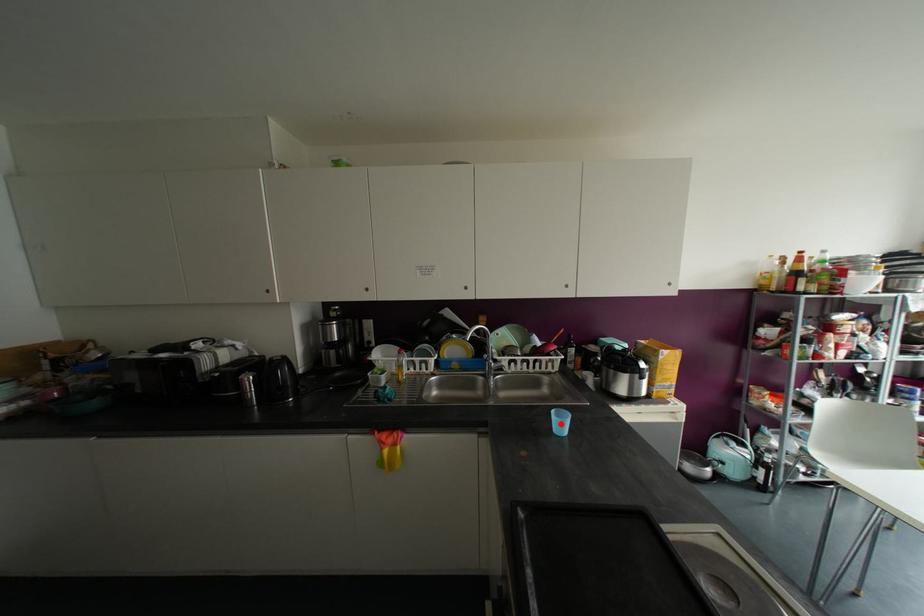
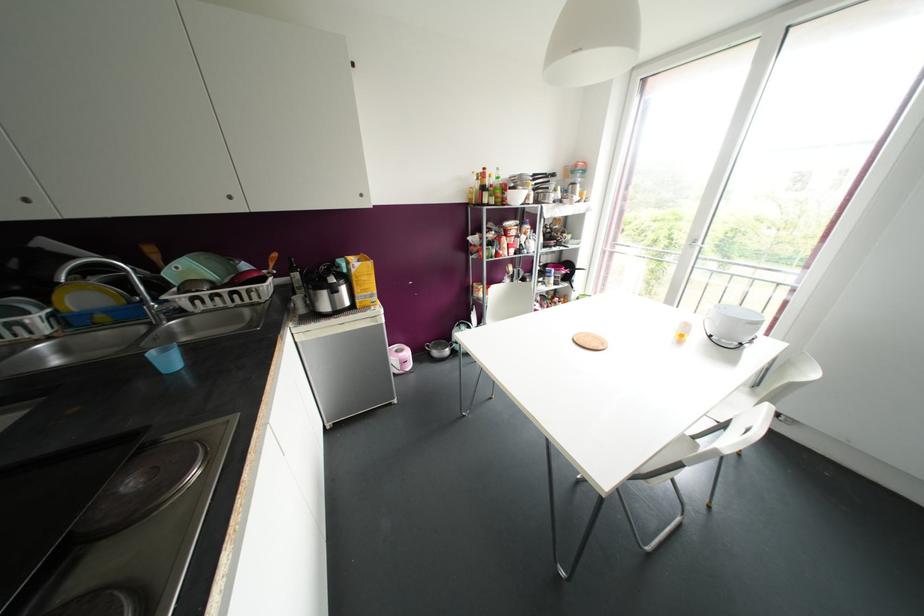
Question: I am providing you with two images of the same scene from different viewpoints. A red point is shown in image1. For the corresponding object point in image2, is it positioned nearer or farther from the camera?

Choices:
 (A) Nearer
 (B) Farther

Answer: (B)